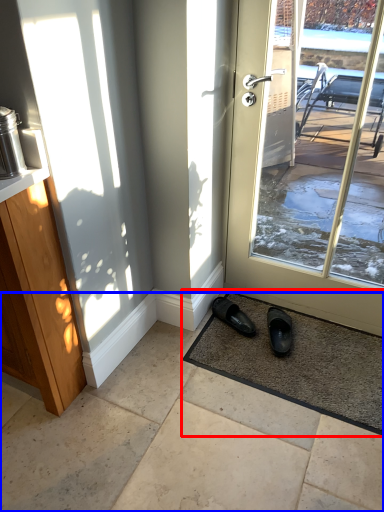
Question: Which object is closer to the camera taking this photo, mat (highlighted by a red box) or concrete (highlighted by a blue box)?

Choices:
 (A) mat
 (B) concrete

Answer: (B)